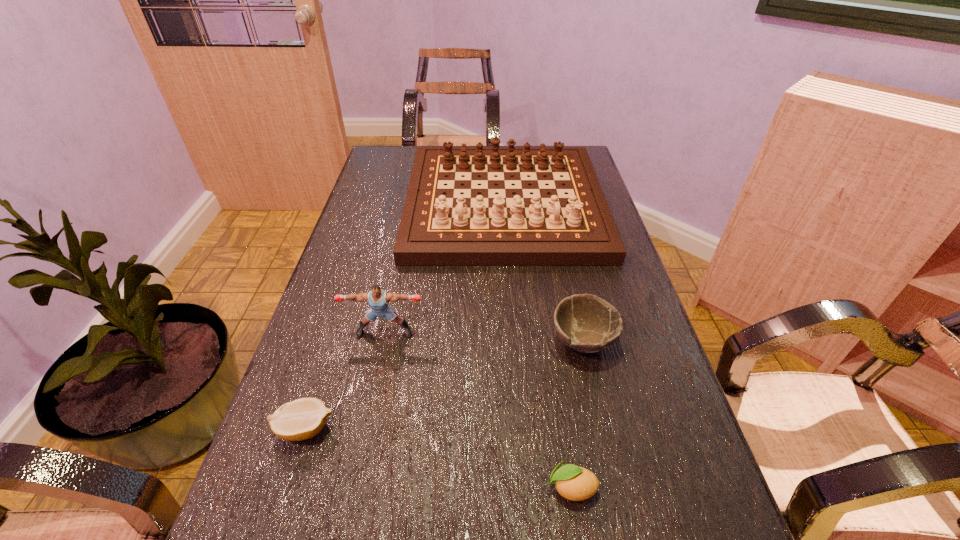
Locate an element on the screen. vacant area between the nearer lemon and the gameboard is located at coordinates (538, 346).

In order to click on vacant space that's between the second nearest object and the third shortest object in this screenshot , I will do `click(444, 385)`.

At what (x,y) coordinates should I click in order to perform the action: click on vacant point located between the shorter lemon and the third shortest object. Please return your answer as a coordinate pair (x, y). Looking at the image, I should click on click(444, 385).

You are a GUI agent. You are given a task and a screenshot of the screen. Output one action in this format:
    pyautogui.click(x=<x>, y=<y>)
    Task: Click on the free space between the bowl and the gameboard
    Image resolution: width=960 pixels, height=540 pixels.
    Given the screenshot: What is the action you would take?
    [543, 273]

Point out which object is positioned as the third nearest to the nearer lemon. Please provide its 2D coordinates. Your answer should be formatted as a tuple, i.e. [(x, y)], where the tuple contains the x and y coordinates of a point satisfying the conditions above.

[(301, 419)]

The width and height of the screenshot is (960, 540). In order to click on object that ranks as the third closest to the nearer lemon in this screenshot , I will do `click(301, 419)`.

Where is `free location that satisfies the following two spatial constraints: 1. on the front-facing side of the puncher; 2. on the right side of the bowl`? The image size is (960, 540). free location that satisfies the following two spatial constraints: 1. on the front-facing side of the puncher; 2. on the right side of the bowl is located at coordinates (383, 341).

Image resolution: width=960 pixels, height=540 pixels. In order to click on vacant position in the image that satisfies the following two spatial constraints: 1. on the side with the white pieces of the bowl; 2. on the left side of the gameboard in this screenshot , I will do `click(515, 341)`.